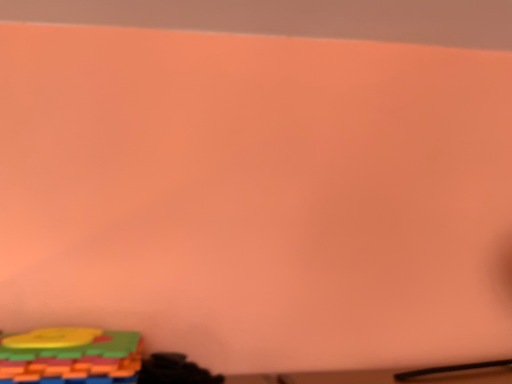
The image size is (512, 384). What do you see at coordinates (174, 371) in the screenshot?
I see `black matte toy at lower left, the second toy positioned from the left` at bounding box center [174, 371].

What is the approximate width of black matte toy at lower left, the second toy positioned from the left?

3.60 inches.

Where is `black matte toy at lower left, the second toy positioned from the left`? The height and width of the screenshot is (384, 512). black matte toy at lower left, the second toy positioned from the left is located at coordinates 174,371.

The width and height of the screenshot is (512, 384). Describe the element at coordinates (74, 361) in the screenshot. I see `multicolored plastic blocks at lower left, which is counted as the second toy, starting from the right` at that location.

In order to face multicolored plastic blocks at lower left, positioned as the first toy in left-to-right order, should I rotate leftwards or rightwards?

To face it directly, rotate left by 24.231 degrees.

This screenshot has width=512, height=384. I want to click on multicolored plastic blocks at lower left, positioned as the first toy in left-to-right order, so click(74, 361).

Locate an element on the screen. black matte toy at lower left, the first toy when ordered from right to left is located at coordinates (174, 371).

Is multicolored plastic blocks at lower left, positioned as the first toy in left-to-right order, at the right side of black matte toy at lower left, the first toy when ordered from right to left?

In fact, multicolored plastic blocks at lower left, positioned as the first toy in left-to-right order, is to the left of black matte toy at lower left, the first toy when ordered from right to left.

Which object is further away from the camera, multicolored plastic blocks at lower left, positioned as the first toy in left-to-right order, or black matte toy at lower left, the second toy positioned from the left?

black matte toy at lower left, the second toy positioned from the left, is further away from the camera.

Is point (99, 347) positioned in front of point (190, 383)?

Yes.

From the image's perspective, is multicolored plastic blocks at lower left, positioned as the first toy in left-to-right order, above black matte toy at lower left, the second toy positioned from the left?

Correct, multicolored plastic blocks at lower left, positioned as the first toy in left-to-right order, appears higher than black matte toy at lower left, the second toy positioned from the left, in the image.

From a real-world perspective, does multicolored plastic blocks at lower left, which is counted as the second toy, starting from the right, sit lower than black matte toy at lower left, the second toy positioned from the left?

No, from a real-world perspective, multicolored plastic blocks at lower left, which is counted as the second toy, starting from the right, is not beneath black matte toy at lower left, the second toy positioned from the left.

Between multicolored plastic blocks at lower left, which is counted as the second toy, starting from the right, and black matte toy at lower left, the second toy positioned from the left, which one has larger width?

With larger width is multicolored plastic blocks at lower left, which is counted as the second toy, starting from the right.

In the scene shown: Between multicolored plastic blocks at lower left, which is counted as the second toy, starting from the right, and black matte toy at lower left, the first toy when ordered from right to left, which one has less height?

Standing shorter between the two is multicolored plastic blocks at lower left, which is counted as the second toy, starting from the right.

Which of these two, multicolored plastic blocks at lower left, which is counted as the second toy, starting from the right, or black matte toy at lower left, the first toy when ordered from right to left, is bigger?

With larger size is multicolored plastic blocks at lower left, which is counted as the second toy, starting from the right.

Based on the photo, would you say black matte toy at lower left, the second toy positioned from the left, is part of multicolored plastic blocks at lower left, which is counted as the second toy, starting from the right,'s contents?

That's incorrect, black matte toy at lower left, the second toy positioned from the left, is not inside multicolored plastic blocks at lower left, which is counted as the second toy, starting from the right.

Looking at this image, is multicolored plastic blocks at lower left, which is counted as the second toy, starting from the right, not near black matte toy at lower left, the second toy positioned from the left?

multicolored plastic blocks at lower left, which is counted as the second toy, starting from the right, is actually quite close to black matte toy at lower left, the second toy positioned from the left.

Is multicolored plastic blocks at lower left, which is counted as the second toy, starting from the right, oriented away from black matte toy at lower left, the second toy positioned from the left?

No, multicolored plastic blocks at lower left, which is counted as the second toy, starting from the right, is not facing away from black matte toy at lower left, the second toy positioned from the left.

How many degrees apart are the facing directions of multicolored plastic blocks at lower left, positioned as the first toy in left-to-right order, and black matte toy at lower left, the first toy when ordered from right to left?

There is a 1.48-degree angle between the facing directions of multicolored plastic blocks at lower left, positioned as the first toy in left-to-right order, and black matte toy at lower left, the first toy when ordered from right to left.

Image resolution: width=512 pixels, height=384 pixels. What are the coordinates of `toy below the multicolored plastic blocks at lower left, positioned as the first toy in left-to-right order (from the image's perspective)` in the screenshot? It's located at (174, 371).

Visually, is black matte toy at lower left, the second toy positioned from the left, positioned to the left or to the right of multicolored plastic blocks at lower left, which is counted as the second toy, starting from the right?

black matte toy at lower left, the second toy positioned from the left, is to the right of multicolored plastic blocks at lower left, which is counted as the second toy, starting from the right.

Which is in front, black matte toy at lower left, the first toy when ordered from right to left, or multicolored plastic blocks at lower left, positioned as the first toy in left-to-right order?

multicolored plastic blocks at lower left, positioned as the first toy in left-to-right order, is in front.

Which is less distant, [166,382] or [96,344]?

Clearly, point [166,382] is more distant from the camera than point [96,344].

From the image's perspective, is black matte toy at lower left, the second toy positioned from the left, positioned above or below multicolored plastic blocks at lower left, positioned as the first toy in left-to-right order?

Clearly, from the image's perspective, black matte toy at lower left, the second toy positioned from the left, is below multicolored plastic blocks at lower left, positioned as the first toy in left-to-right order.

Consider the image. From a real-world perspective, between black matte toy at lower left, the second toy positioned from the left, and multicolored plastic blocks at lower left, positioned as the first toy in left-to-right order, who is vertically higher?

multicolored plastic blocks at lower left, positioned as the first toy in left-to-right order.

Considering the sizes of objects black matte toy at lower left, the second toy positioned from the left, and multicolored plastic blocks at lower left, positioned as the first toy in left-to-right order, in the image provided, who is wider, black matte toy at lower left, the second toy positioned from the left, or multicolored plastic blocks at lower left, positioned as the first toy in left-to-right order,?

multicolored plastic blocks at lower left, positioned as the first toy in left-to-right order, is wider.

Is black matte toy at lower left, the second toy positioned from the left, taller than multicolored plastic blocks at lower left, positioned as the first toy in left-to-right order?

Correct, black matte toy at lower left, the second toy positioned from the left, is much taller as multicolored plastic blocks at lower left, positioned as the first toy in left-to-right order.

Based on their sizes in the image, would you say black matte toy at lower left, the first toy when ordered from right to left, is bigger or smaller than multicolored plastic blocks at lower left, positioned as the first toy in left-to-right order?

Considering their sizes, black matte toy at lower left, the first toy when ordered from right to left, takes up less space than multicolored plastic blocks at lower left, positioned as the first toy in left-to-right order.

Would you say black matte toy at lower left, the second toy positioned from the left, is outside multicolored plastic blocks at lower left, positioned as the first toy in left-to-right order?

Yes, black matte toy at lower left, the second toy positioned from the left, is located beyond the bounds of multicolored plastic blocks at lower left, positioned as the first toy in left-to-right order.

Is black matte toy at lower left, the first toy when ordered from right to left, next to multicolored plastic blocks at lower left, which is counted as the second toy, starting from the right, and touching it?

They are not placed beside each other.

Is black matte toy at lower left, the first toy when ordered from right to left, positioned with its back to multicolored plastic blocks at lower left, which is counted as the second toy, starting from the right?

No, multicolored plastic blocks at lower left, which is counted as the second toy, starting from the right, is not at the back of black matte toy at lower left, the first toy when ordered from right to left.

This screenshot has height=384, width=512. In order to click on toy above the black matte toy at lower left, the second toy positioned from the left (from a real-world perspective) in this screenshot , I will do `click(74, 361)`.

Where is `toy located on the right of multicolored plastic blocks at lower left, positioned as the first toy in left-to-right order`? This screenshot has width=512, height=384. toy located on the right of multicolored plastic blocks at lower left, positioned as the first toy in left-to-right order is located at coordinates (174, 371).

Identify the location of toy above the black matte toy at lower left, the second toy positioned from the left (from a real-world perspective). (74, 361).